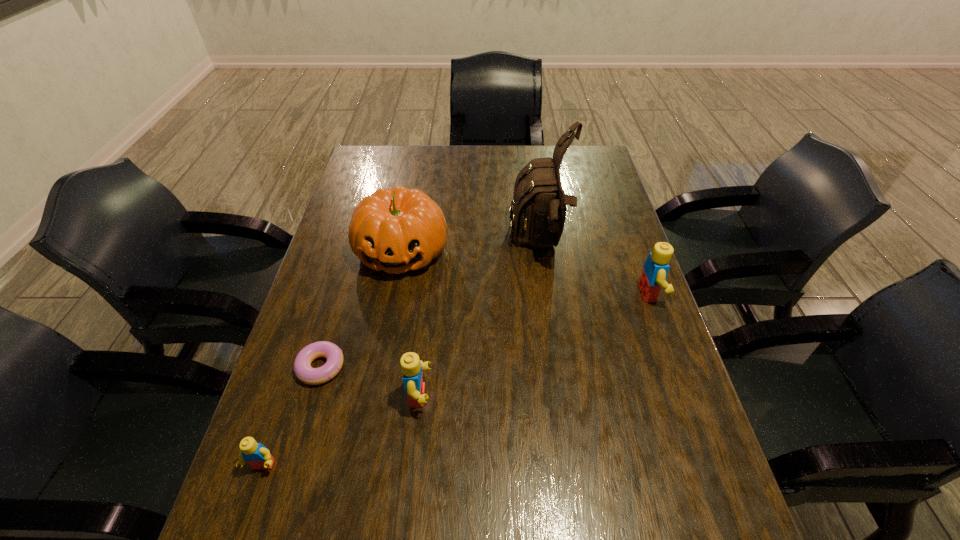
Locate an element on the screen. Image resolution: width=960 pixels, height=540 pixels. the shortest Lego is located at coordinates (257, 455).

You are a GUI agent. You are given a task and a screenshot of the screen. Output one action in this format:
    pyautogui.click(x=<x>, y=<y>)
    Task: Click on the nearest Lego
    The width and height of the screenshot is (960, 540).
    Given the screenshot: What is the action you would take?
    pyautogui.click(x=257, y=455)

The height and width of the screenshot is (540, 960). Find the location of `the third shortest object`. the third shortest object is located at coordinates (411, 366).

Locate an element on the screen. the second Lego from left to right is located at coordinates (411, 366).

In order to click on the rightmost Lego in this screenshot , I will do `click(655, 269)`.

Locate an element on the screen. Image resolution: width=960 pixels, height=540 pixels. the farthest Lego is located at coordinates (655, 269).

Identify the location of the tallest object. (539, 202).

Locate an element on the screen. shoulder bag is located at coordinates (539, 202).

This screenshot has width=960, height=540. What are the coordinates of `pumpkin` in the screenshot? It's located at (401, 229).

At what (x,y) coordinates should I click in order to perform the action: click on the shortest object. Please return your answer as a coordinate pair (x, y). Looking at the image, I should click on (304, 372).